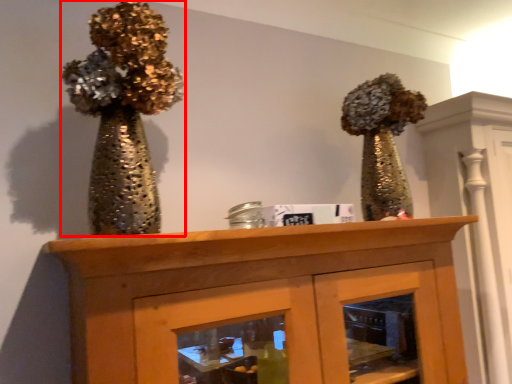
Question: Where is floral arrangement (annotated by the red box) located in relation to furniture in the image?

Choices:
 (A) right
 (B) left

Answer: (B)